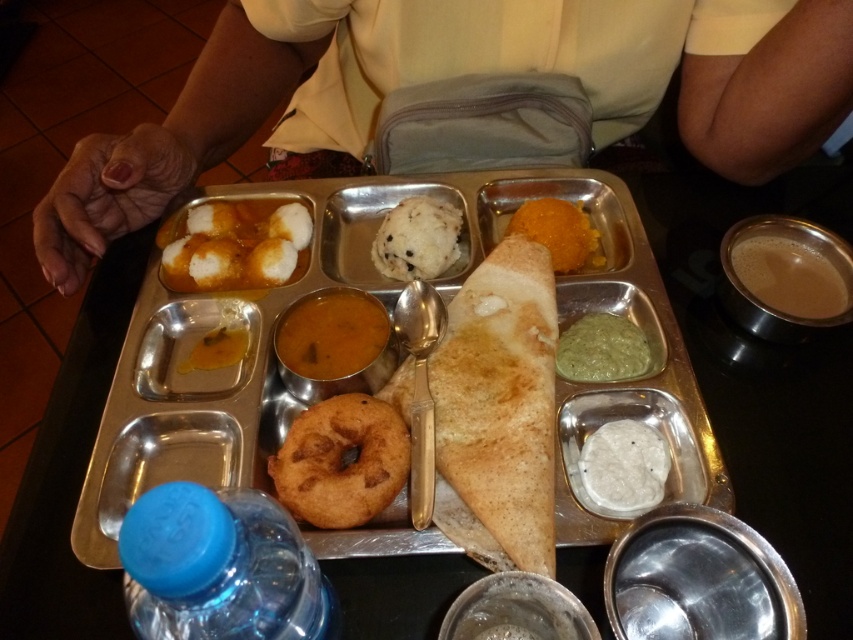
Question: Is the position of blue plastic bottle at lower left more distant than that of white matte rice ball at center?

Choices:
 (A) no
 (B) yes

Answer: (A)

Question: Does white matte rice ball at center have a greater width compared to yellow matte curry at center?

Choices:
 (A) yes
 (B) no

Answer: (A)

Question: Which point is farther to the camera?

Choices:
 (A) yellow matte curry at center
 (B) brown matte curry at center

Answer: (A)

Question: Estimate the real-world distances between objects in this image. Which object is closer to the blue plastic bottle at lower left?

Choices:
 (A) brown frothy liquid at upper right
 (B) white matte idli at upper left
 (C) silver metallic tray at center

Answer: (C)

Question: Which object is farther from the camera taking this photo?

Choices:
 (A) blue plastic bottle at lower left
 (B) silver metallic tray at center
 (C) brown matte curry at center

Answer: (C)

Question: Does brown frothy liquid at upper right appear on the left side of orange smoothie at upper right?

Choices:
 (A) yes
 (B) no

Answer: (B)